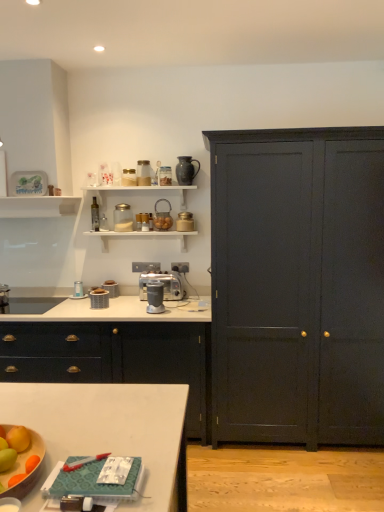
Question: Is transparent glass jar at upper center, which is the seventh appliance in bottom-to-top order, to the left of matte black cupboard at right from the viewer's perspective?

Choices:
 (A) no
 (B) yes

Answer: (B)

Question: Is transparent glass jar at upper center, which is the seventh appliance in bottom-to-top order, looking in the opposite direction of matte black cupboard at right?

Choices:
 (A) no
 (B) yes

Answer: (A)

Question: Is transparent glass jar at upper center, which is the seventh appliance in bottom-to-top order, positioned beyond the bounds of matte black cupboard at right?

Choices:
 (A) yes
 (B) no

Answer: (A)

Question: From the image's perspective, would you say transparent glass jar at upper center, which is the seventh appliance in bottom-to-top order, is shown under matte black cupboard at right?

Choices:
 (A) no
 (B) yes

Answer: (A)

Question: Is the position of transparent glass jar at upper center, which is the seventh appliance in bottom-to-top order, more distant than that of matte black cupboard at right?

Choices:
 (A) no
 (B) yes

Answer: (B)

Question: Is transparent glass jar at upper center, which is counted as the fifth appliance, starting from the top, beside matte black cupboard at right?

Choices:
 (A) yes
 (B) no

Answer: (B)

Question: Are metallic silver toaster at upper center, the 6th appliance from the top, and clear glass jar at upper center, arranged as the 2th appliance when viewed from the top, making contact?

Choices:
 (A) no
 (B) yes

Answer: (A)

Question: Does metallic silver toaster at upper center, arranged as the 6th appliance when ordered from the bottom, lie behind clear glass jar at upper center, marked as the tenth appliance in a bottom-to-top arrangement?

Choices:
 (A) yes
 (B) no

Answer: (A)

Question: Could clear glass jar at upper center, arranged as the 2th appliance when viewed from the top, be considered to be inside metallic silver toaster at upper center, the 6th appliance from the top?

Choices:
 (A) no
 (B) yes

Answer: (A)

Question: Considering the relative sizes of metallic silver toaster at upper center, arranged as the 6th appliance when ordered from the bottom, and clear glass jar at upper center, arranged as the 2th appliance when viewed from the top, in the image provided, is metallic silver toaster at upper center, arranged as the 6th appliance when ordered from the bottom, bigger than clear glass jar at upper center, arranged as the 2th appliance when viewed from the top,?

Choices:
 (A) yes
 (B) no

Answer: (B)

Question: From the image's perspective, is metallic silver toaster at upper center, arranged as the 6th appliance when ordered from the bottom, located above clear glass jar at upper center, arranged as the 2th appliance when viewed from the top?

Choices:
 (A) no
 (B) yes

Answer: (A)

Question: Can you confirm if metallic silver toaster at upper center, the 6th appliance from the top, is positioned to the right of clear glass jar at upper center, arranged as the 2th appliance when viewed from the top?

Choices:
 (A) yes
 (B) no

Answer: (A)

Question: From a real-world perspective, is metallic silver toaster at upper center, the eighth appliance in the bottom-to-top sequence, on top of metallic gold canister at upper center, arranged as the 7th appliance when viewed from the top?

Choices:
 (A) no
 (B) yes

Answer: (B)